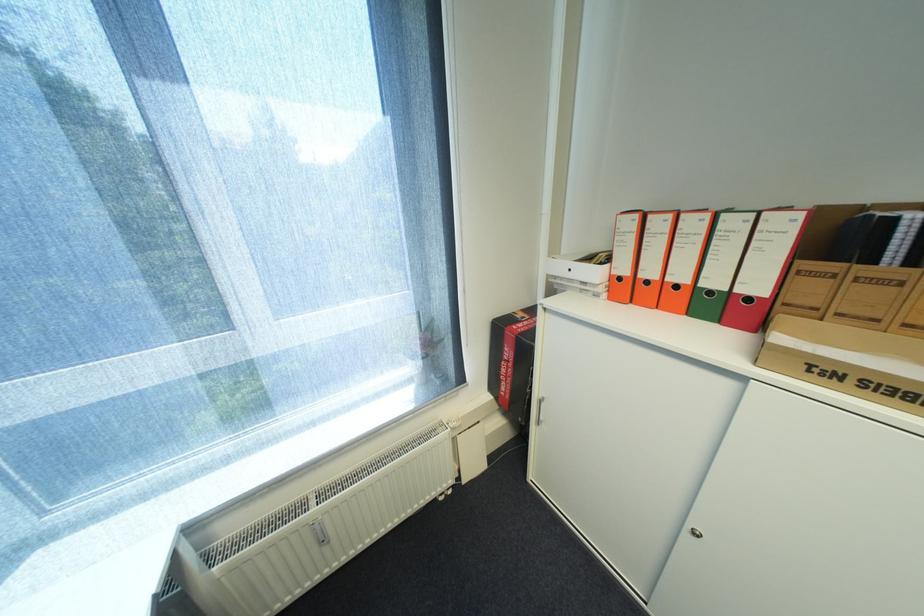
The location [513,363] corresponds to which object?

This point indicates the red and black box.